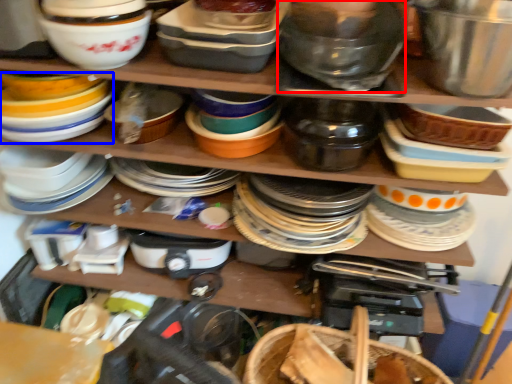
Question: Which point is closer to the camera, bowl (highlighted by a red box) or appliance (highlighted by a blue box)?

Choices:
 (A) bowl
 (B) appliance

Answer: (A)